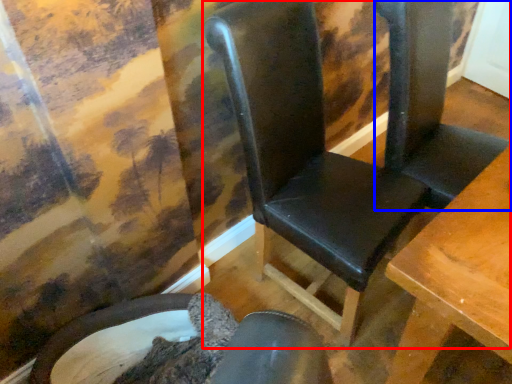
Question: Which object appears closest to the camera in this image, chair (highlighted by a red box) or folding chair (highlighted by a blue box)?

Choices:
 (A) chair
 (B) folding chair

Answer: (A)